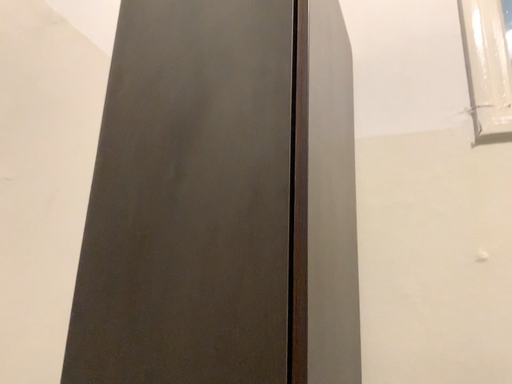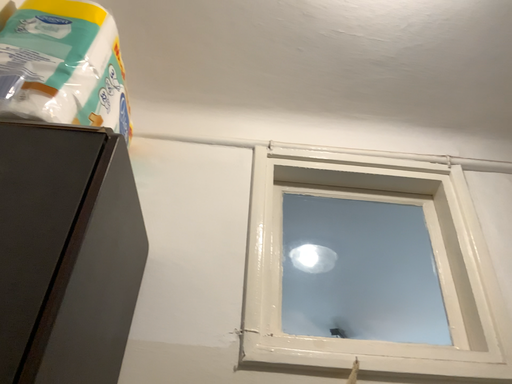
Question: Which way did the camera rotate in the video?

Choices:
 (A) rotated left
 (B) rotated right

Answer: (B)